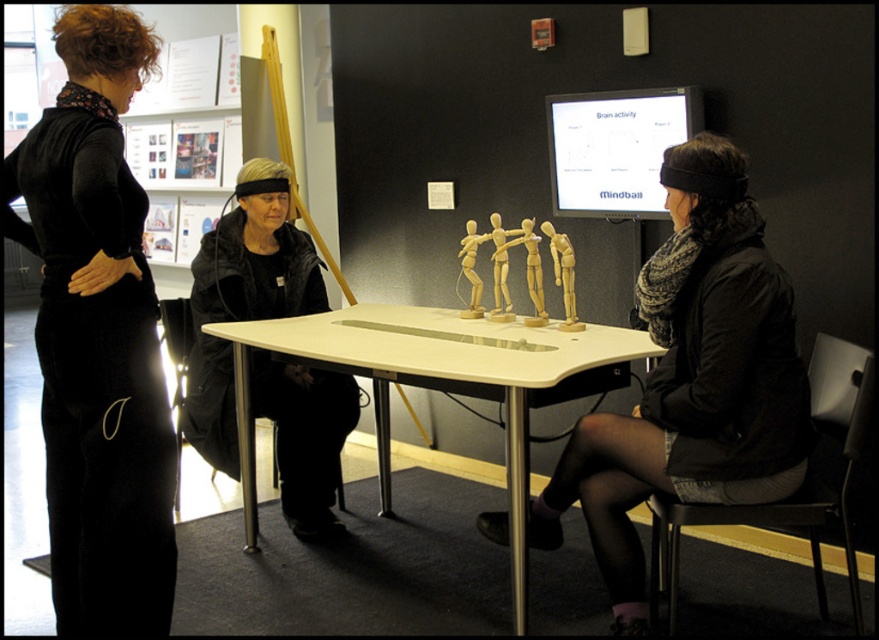
You are standing in the museum and want to take a photo of the black fabric dress at left without moving any objects. Can you step forward to get closer? Explain why or why not based on the distance provided.

The black fabric dress at left and the viewer are 5.74 feet apart. Since 5.74 feet is approximately 1.75 meters, which is a reasonable distance for taking a photo, you can step forward to get closer as long as it doesn not disturb the exhibit or violate any museum guidelines.

You are standing in the museum and want to move from the point at coordinates (187, 419) to the point at (249, 472). Which direction should you move to get closer to your destination?

You should move forward because the point at (187, 419) is closer to you than the point at (249, 472), so moving forward will take you towards it.